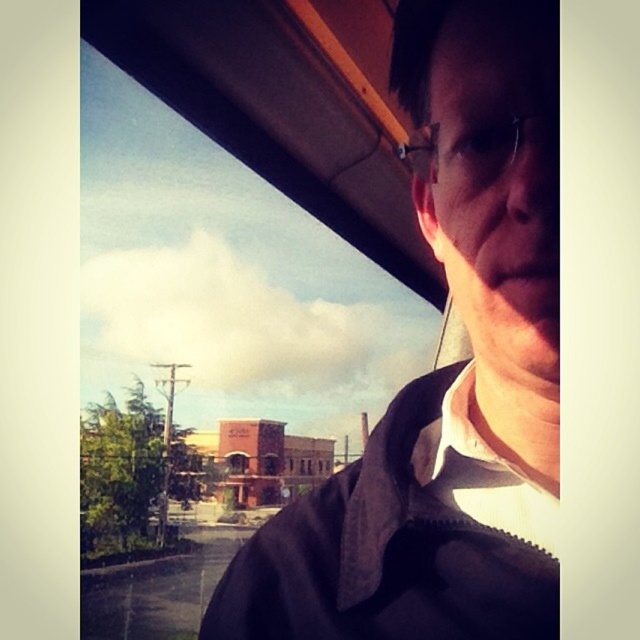
Question: Considering the relative positions of brown fabric jacket at upper right and clear plastic glasses at upper center in the image provided, where is brown fabric jacket at upper right located with respect to clear plastic glasses at upper center?

Choices:
 (A) above
 (B) below

Answer: (B)

Question: Which of the following is the farthest from the observer?

Choices:
 (A) (490, 145)
 (B) (362, 496)

Answer: (B)

Question: Is brown fabric jacket at upper right bigger than clear plastic glasses at upper center?

Choices:
 (A) yes
 (B) no

Answer: (A)

Question: Can you confirm if brown fabric jacket at upper right is positioned to the left of clear plastic glasses at upper center?

Choices:
 (A) no
 (B) yes

Answer: (B)